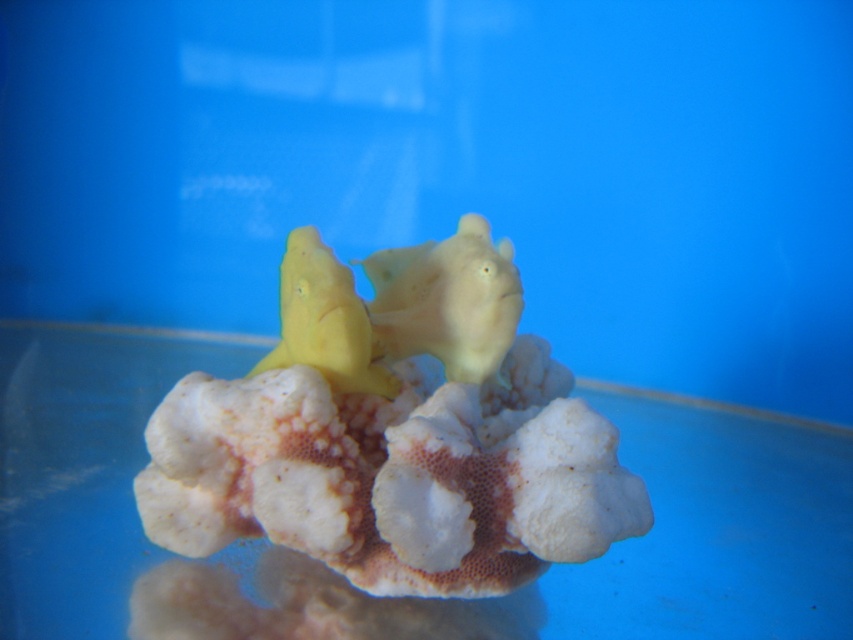
You are an aquarium caretaker who needs to ensure the two fish are not overlapping. You see the matte yellow fish at center and the yellow matte fish at center. Which fish is placed higher in the aquarium?

The matte yellow fish at center is positioned over the yellow matte fish at center, so it is placed higher in the aquarium.

You are an aquarium designer and need to determine the spacing between two fish in an aquarium. You observe two fish in the image labeled as matte yellow fish at center and yellow matte fish at center. Which fish requires more horizontal space due to its width?

The matte yellow fish at center might be wider than yellow matte fish at center, so it requires more horizontal space.

You are an aquarium caretaker who needs to place a divider between the two matte yellow fish at center. The divider is 1 meter long. Will the divider fit between them?

The two matte yellow fish at center are 1.10 meters apart, so a 1 meter long divider will fit between them since it is shorter than the distance between the fish.